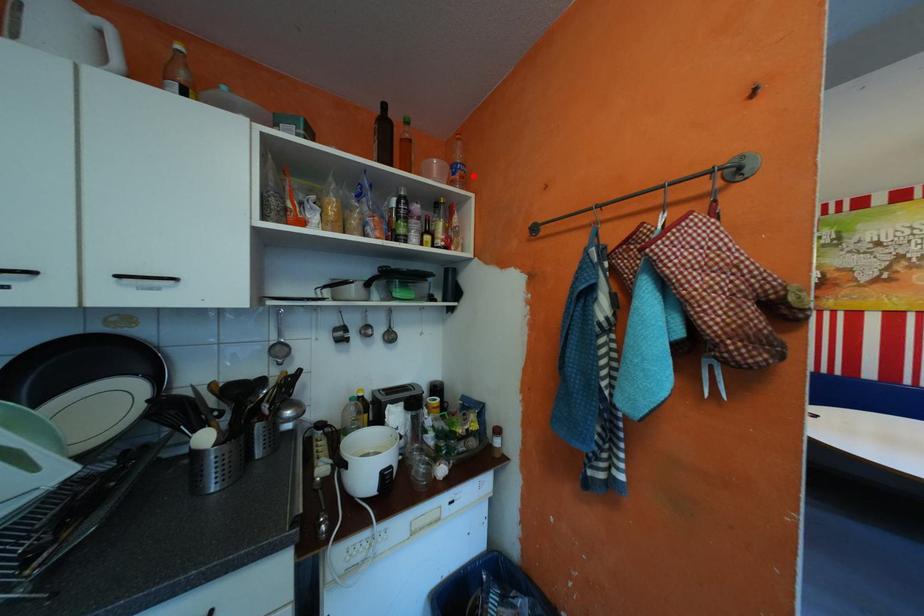
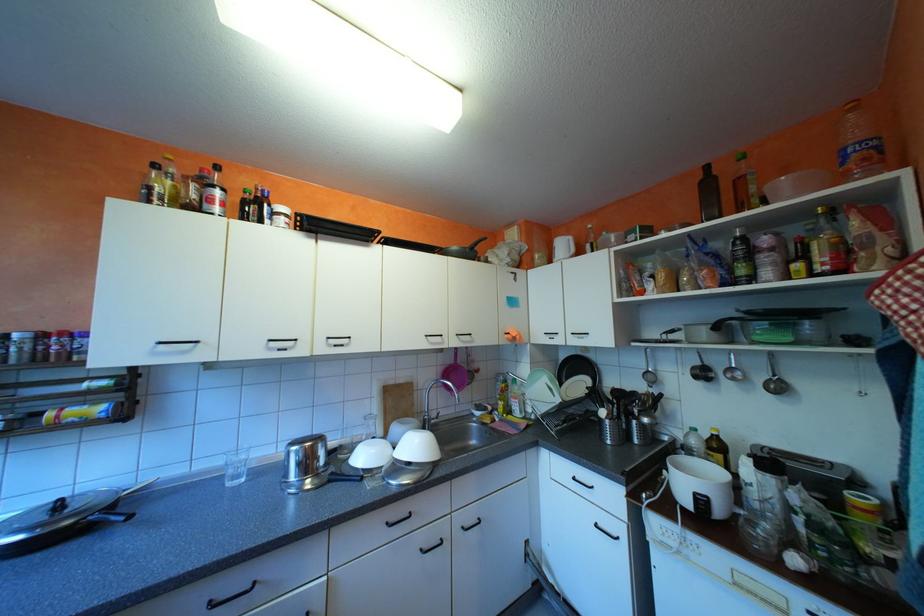
The point at the highlighted location is marked in the first image. Where is the corresponding point in the second image?

(877, 159)